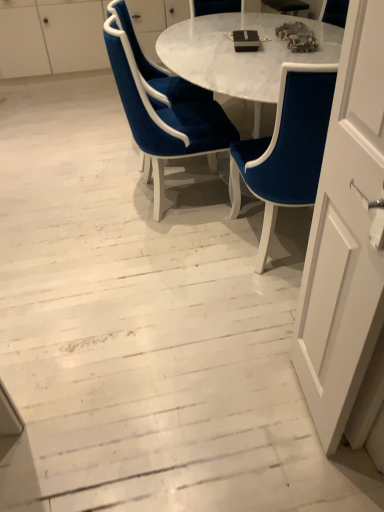
Question: Considering the relative positions of white glossy dresser at upper center and velvet blue chair at center, acting as the 2th chair starting from the right, in the image provided, is white glossy dresser at upper center to the left of velvet blue chair at center, acting as the 2th chair starting from the right, from the viewer's perspective?

Choices:
 (A) no
 (B) yes

Answer: (B)

Question: Would you consider white glossy dresser at upper center to be distant from velvet blue chair at center, acting as the 2th chair starting from the right?

Choices:
 (A) no
 (B) yes

Answer: (B)

Question: From a real-world perspective, is white glossy dresser at upper center located beneath velvet blue chair at center, which appears as the 2th chair when viewed from the left?

Choices:
 (A) no
 (B) yes

Answer: (B)

Question: Is velvet blue chair at center, which appears as the 2th chair when viewed from the left, at the back of white glossy dresser at upper center?

Choices:
 (A) yes
 (B) no

Answer: (B)

Question: Does white glossy dresser at upper center have a larger size compared to velvet blue chair at center, acting as the 2th chair starting from the right?

Choices:
 (A) yes
 (B) no

Answer: (A)

Question: In terms of size, does white glossy dresser at upper center appear bigger or smaller than velvet blue chair at center, acting as the 2th chair starting from the right?

Choices:
 (A) big
 (B) small

Answer: (A)

Question: From a real-world perspective, is white glossy dresser at upper center physically located above or below velvet blue chair at center, acting as the 2th chair starting from the right?

Choices:
 (A) below
 (B) above

Answer: (A)

Question: Is white glossy dresser at upper center wider or thinner than velvet blue chair at center, which appears as the 2th chair when viewed from the left?

Choices:
 (A) thin
 (B) wide

Answer: (A)

Question: Is white glossy dresser at upper center inside the boundaries of velvet blue chair at center, which appears as the 2th chair when viewed from the left, or outside?

Choices:
 (A) inside
 (B) outside

Answer: (B)

Question: Is point (304, 194) positioned closer to the camera than point (72, 34)?

Choices:
 (A) closer
 (B) farther

Answer: (A)

Question: Relative to white glossy dresser at upper center, is velvet blue chair at center, the 3th chair from the left, in front or behind?

Choices:
 (A) behind
 (B) front

Answer: (B)

Question: Is velvet blue chair at center, the 3th chair from the left, wider or thinner than white glossy dresser at upper center?

Choices:
 (A) thin
 (B) wide

Answer: (A)

Question: From a real-world perspective, is velvet blue chair at center, which is the 1th chair from right to left, physically located above or below white glossy dresser at upper center?

Choices:
 (A) below
 (B) above

Answer: (B)

Question: In terms of width, does velvet blue chair at center, the first chair positioned from the left, look wider or thinner when compared to velvet blue chair at center, acting as the 2th chair starting from the right?

Choices:
 (A) wide
 (B) thin

Answer: (B)

Question: Is velvet blue chair at center, the first chair positioned from the left, situated inside velvet blue chair at center, which appears as the 2th chair when viewed from the left, or outside?

Choices:
 (A) outside
 (B) inside

Answer: (A)